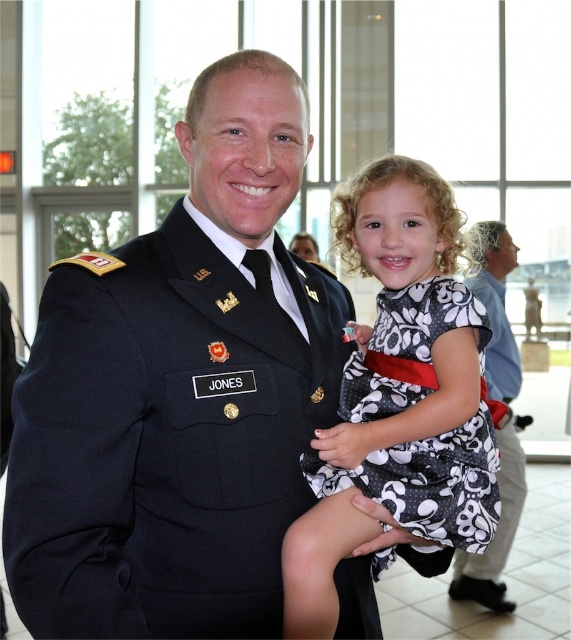
Question: Which point is farther to the camera?

Choices:
 (A) (34, 369)
 (B) (456, 563)
 (C) (408, 520)

Answer: (B)

Question: Does dark blue uniform at center have a greater width compared to black dotted fabric dress at center?

Choices:
 (A) yes
 (B) no

Answer: (A)

Question: Among these objects, which one is nearest to the camera?

Choices:
 (A) black dotted dress at center
 (B) dark blue uniform at center
 (C) black dotted fabric dress at center

Answer: (B)

Question: Can you confirm if black dotted fabric dress at center is positioned below black dotted dress at center?

Choices:
 (A) no
 (B) yes

Answer: (A)

Question: Is dark blue uniform at center smaller than black dotted dress at center?

Choices:
 (A) yes
 (B) no

Answer: (A)

Question: Which object is positioned farthest from the black dotted fabric dress at center?

Choices:
 (A) black dotted dress at center
 (B) dark blue uniform at center

Answer: (A)